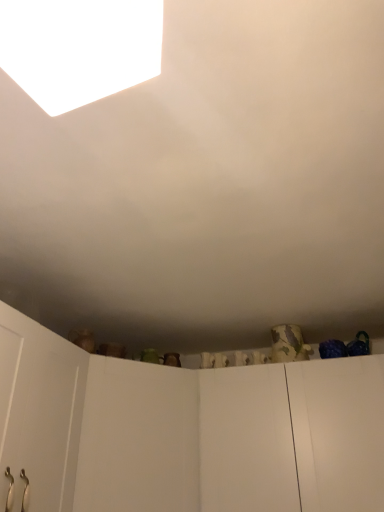
Identify the location of white matte door at center. (138, 438).

This screenshot has height=512, width=384. Describe the element at coordinates (138, 438) in the screenshot. I see `white matte door at center` at that location.

Locate an element on the screen. white matte light at upper left is located at coordinates (79, 48).

Describe the element at coordinates (79, 48) in the screenshot. Image resolution: width=384 pixels, height=512 pixels. I see `white matte light at upper left` at that location.

Find the location of a particular element. The height and width of the screenshot is (512, 384). white matte door at center is located at coordinates (138, 438).

Does white matte door at center appear on the left side of white matte light at upper left?

Correct, you'll find white matte door at center to the left of white matte light at upper left.

Considering their positions, is white matte door at center located in front of or behind white matte light at upper left?

white matte door at center is positioned farther from the viewer than white matte light at upper left.

Is point (153, 421) in front of point (32, 93)?

No, (153, 421) is further to viewer.

From the image's perspective, which object appears higher, white matte door at center or white matte light at upper left?

From the image's view, white matte light at upper left is above.

Based on the photo, from a real-world perspective, which is physically above, white matte door at center or white matte light at upper left?

white matte light at upper left, from a real-world perspective.

Considering the sizes of objects white matte door at center and white matte light at upper left in the image provided, who is thinner, white matte door at center or white matte light at upper left?

With smaller width is white matte light at upper left.

Who is taller, white matte door at center or white matte light at upper left?

white matte door at center.

Considering the relative sizes of white matte door at center and white matte light at upper left in the image provided, is white matte door at center smaller than white matte light at upper left?

No, white matte door at center is not smaller than white matte light at upper left.

Based on the photo, is white matte door at center located outside white matte light at upper left?

Yes, white matte door at center is located beyond the bounds of white matte light at upper left.

Are white matte door at center and white matte light at upper left located far from each other?

Yes.

Is white matte door at center aimed at white matte light at upper left?

No, white matte door at center does not turn towards white matte light at upper left.

In the scene shown: How different are the orientations of white matte door at center and white matte light at upper left in degrees?

white matte door at center and white matte light at upper left are facing 34.2 degrees away from each other.

How much distance is there between white matte door at center and white matte light at upper left?

The distance of white matte door at center from white matte light at upper left is 4.35 feet.

Identify the location of door below the white matte light at upper left (from a real-world perspective). This screenshot has height=512, width=384. (138, 438).

Between white matte light at upper left and white matte door at center, which one appears on the right side from the viewer's perspective?

white matte light at upper left.

Is white matte light at upper left further to the viewer compared to white matte door at center?

No, it is in front of white matte door at center.

Considering the points (55, 100) and (129, 374), which point is in front, point (55, 100) or point (129, 374)?

Point (55, 100)

From the image's perspective, is white matte light at upper left located beneath white matte door at center?

No.

Looking at this image, from a real-world perspective, is white matte light at upper left beneath white matte door at center?

No.

Based on the photo, considering the sizes of objects white matte light at upper left and white matte door at center in the image provided, who is wider, white matte light at upper left or white matte door at center?

A: Wider between the two is white matte door at center.

Considering the relative sizes of white matte light at upper left and white matte door at center in the image provided, is white matte light at upper left taller than white matte door at center?

No.

Which of these two, white matte light at upper left or white matte door at center, is bigger?

With larger size is white matte door at center.

Is white matte light at upper left outside of white matte door at center?

Yes, white matte light at upper left is located beyond the bounds of white matte door at center.

Is white matte light at upper left touching white matte door at center?

No, white matte light at upper left is not beside white matte door at center.

Is white matte light at upper left looking in the opposite direction of white matte door at center?

That's not correct — white matte light at upper left is not looking away from white matte door at center.

Can you tell me how much white matte light at upper left and white matte door at center differ in facing direction?

They differ by 34.2 degrees in their facing directions.

In order to click on light on the right of white matte door at center in this screenshot , I will do `click(79, 48)`.

There is a white matte door at center. In order to click on light above it (from a real-world perspective) in this screenshot , I will do `click(79, 48)`.

Find the location of a particular element. The image size is (384, 512). door lying on the left of white matte light at upper left is located at coordinates (138, 438).